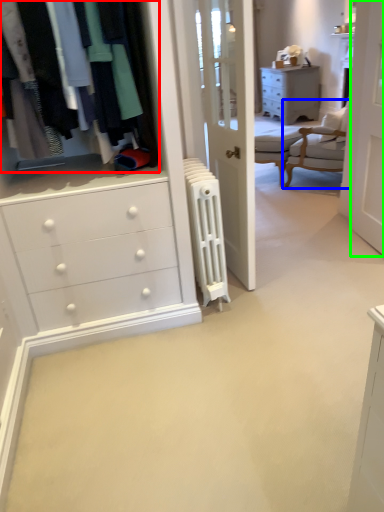
Question: Estimate the real-world distances between objects in this image. Which object is closer to closet (highlighted by a red box), chair (highlighted by a blue box) or screen door (highlighted by a green box)?

Choices:
 (A) chair
 (B) screen door

Answer: (B)